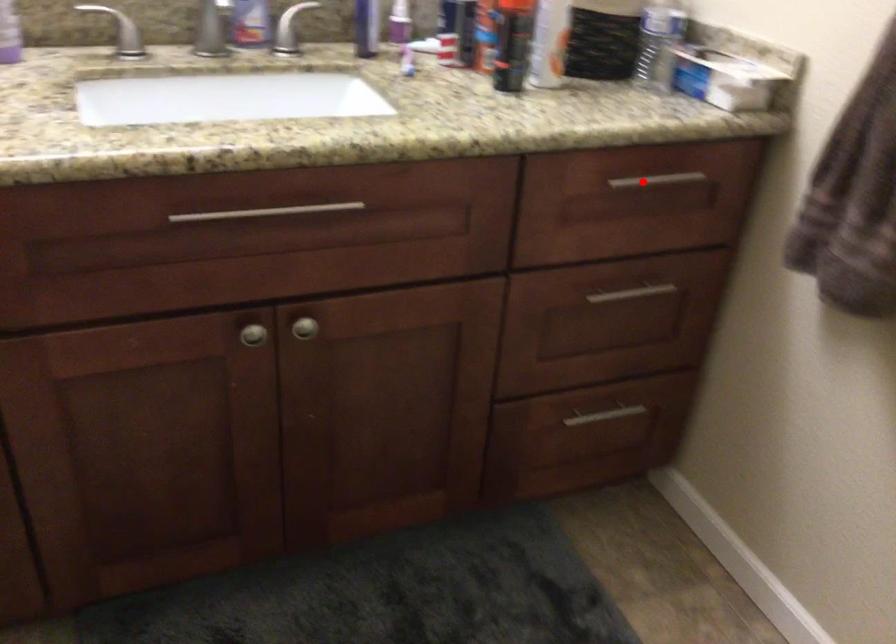
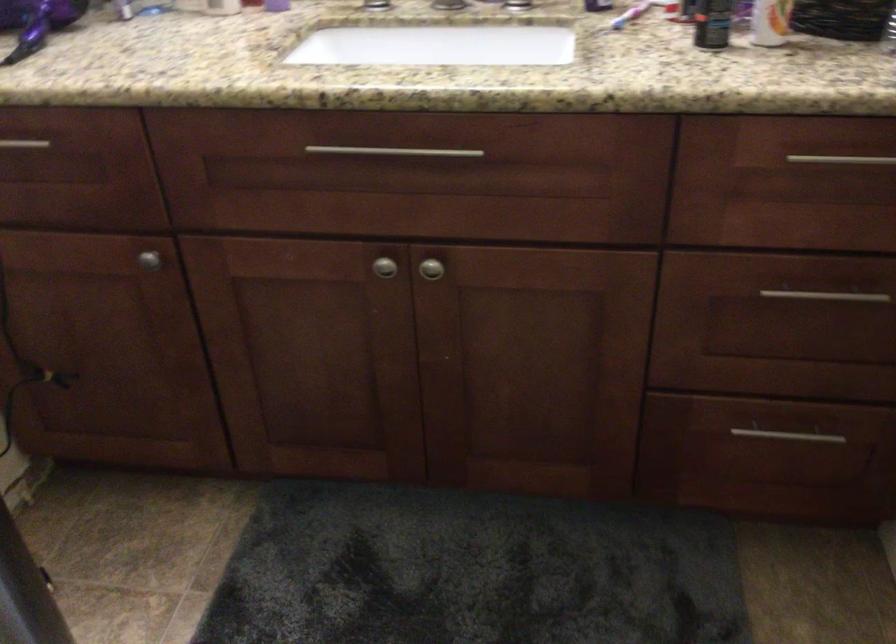
Question: I am providing you with two images of the same scene from different viewpoints. Given a red point in image1, look at the same physical point in image2. Is it:

Choices:
 (A) Closer to the viewpoint
 (B) Farther from the viewpoint

Answer: (A)